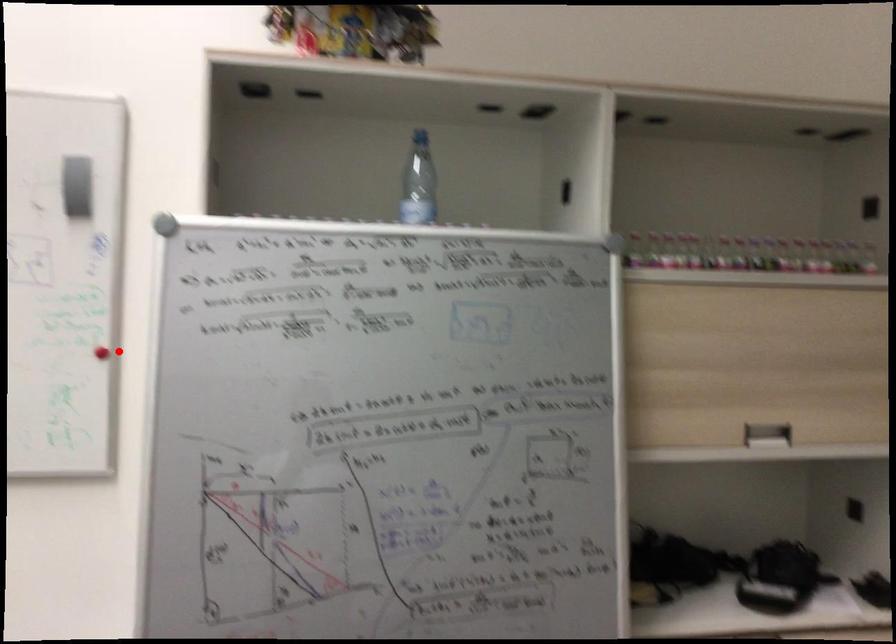
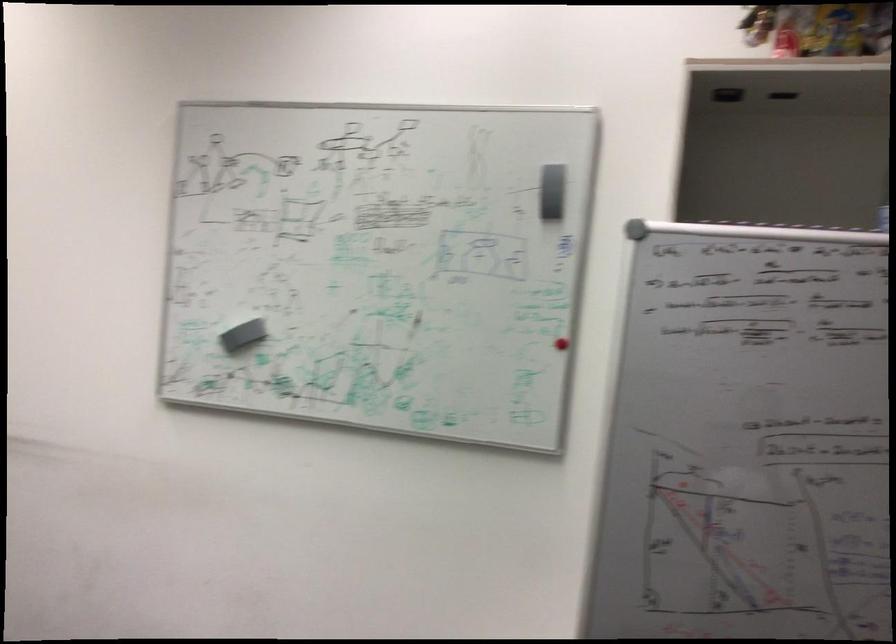
Question: I am providing you with two images of the same scene from different viewpoints. A red point is marked on the first image. Can you still see the location of the red point in image 2?

Choices:
 (A) Yes
 (B) No

Answer: (A)